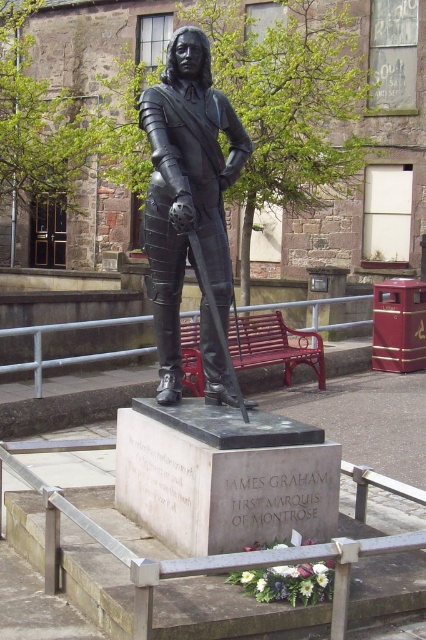
Question: Does bronze armor at center have a greater width compared to metallic red bench at center?

Choices:
 (A) no
 (B) yes

Answer: (A)

Question: Which of the following is the farthest from the observer?

Choices:
 (A) (235, 344)
 (B) (155, 298)

Answer: (A)

Question: Does bronze armor at center appear over metallic red bench at center?

Choices:
 (A) no
 (B) yes

Answer: (B)

Question: Which object appears farthest from the camera in this image?

Choices:
 (A) bronze armor at center
 (B) metallic red bench at center

Answer: (B)

Question: Which object is farther from the camera taking this photo?

Choices:
 (A) metallic red bench at center
 (B) bronze armor at center

Answer: (A)

Question: Does bronze armor at center appear over metallic red bench at center?

Choices:
 (A) yes
 (B) no

Answer: (A)